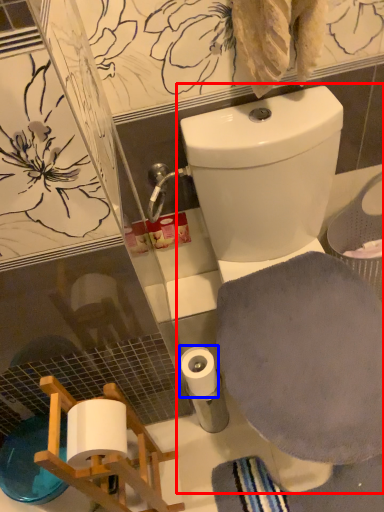
Question: Which of the following is the closest to the observer, toilet (highlighted by a red box) or toilet paper (highlighted by a blue box)?

Choices:
 (A) toilet
 (B) toilet paper

Answer: (A)